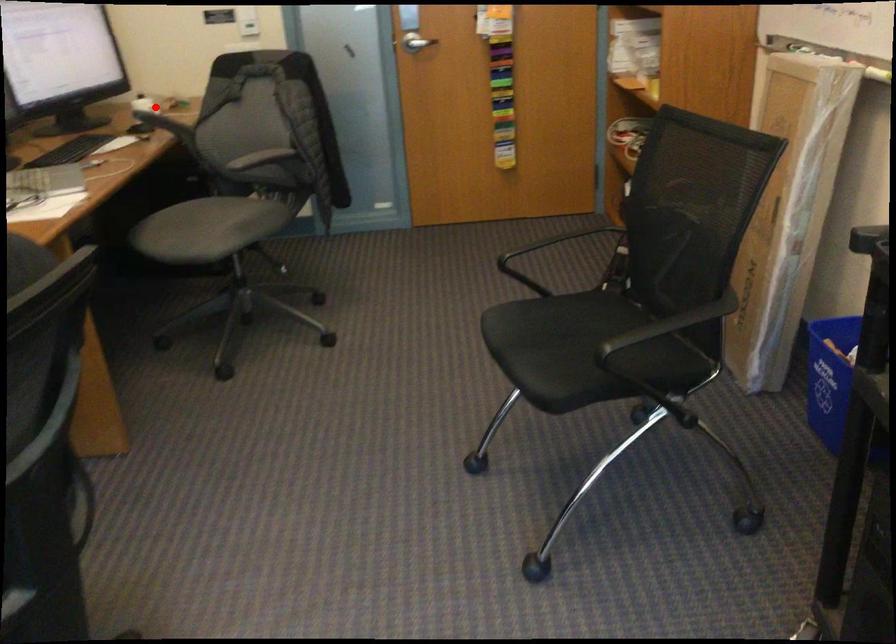
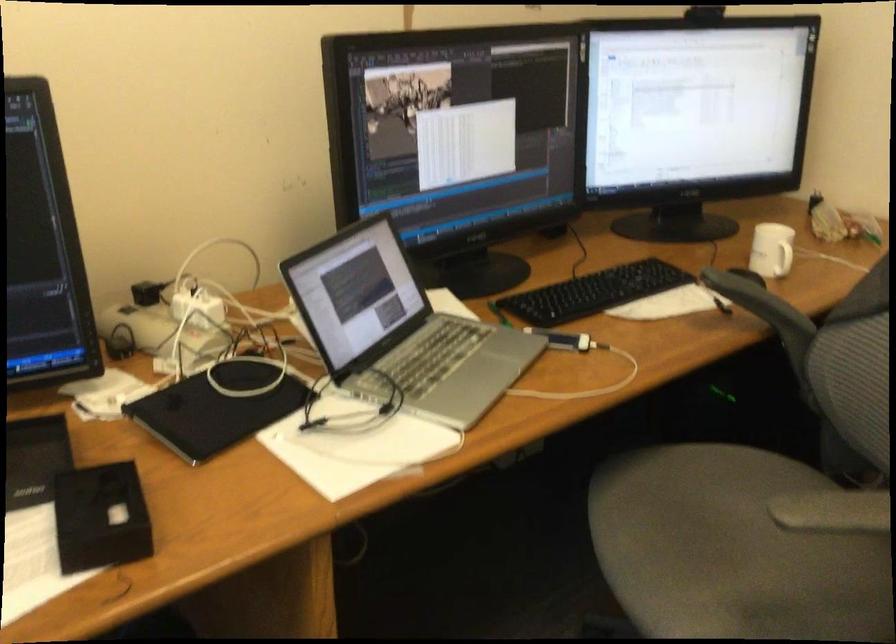
In the second image, find the point that corresponds to the highlighted location in the first image.

(782, 259)